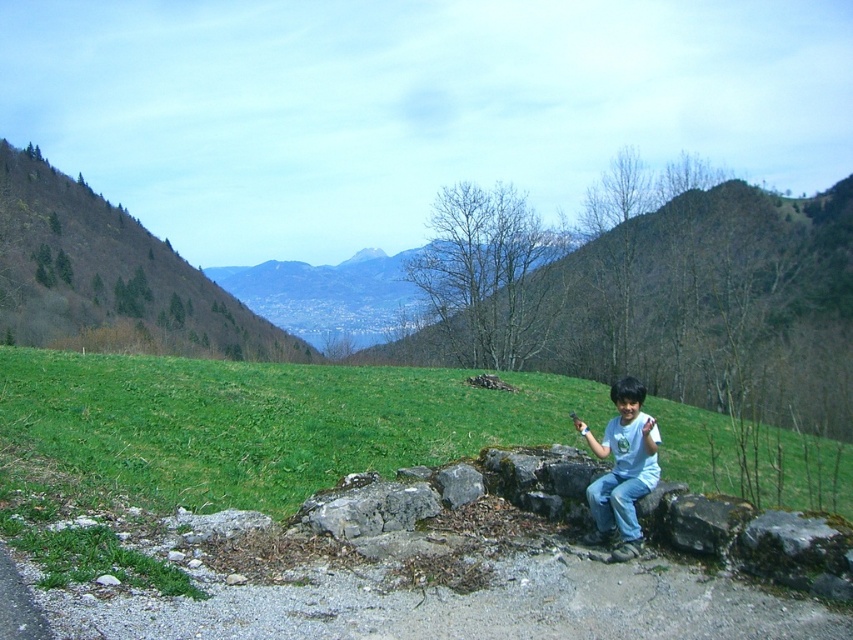
You are standing at the point labeled as point (x=265, y=420) in the image. Looking around, what is the most prominent feature directly beneath your feet?

The most prominent feature directly beneath your feet at point (x=265, y=420) is the green grassy hillside at center.

You are standing at the edge of the gravel path and see the blue denim jeans at lower center and the green leafy hillside at upper left. Which object is positioned to the left of the other?

The green leafy hillside at upper left is to the left of the blue denim jeans at lower center.